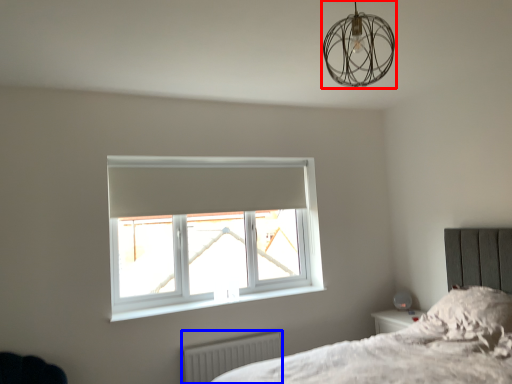
Question: Which object appears closest to the camera in this image, lamp (highlighted by a red box) or radiator (highlighted by a blue box)?

Choices:
 (A) lamp
 (B) radiator

Answer: (A)